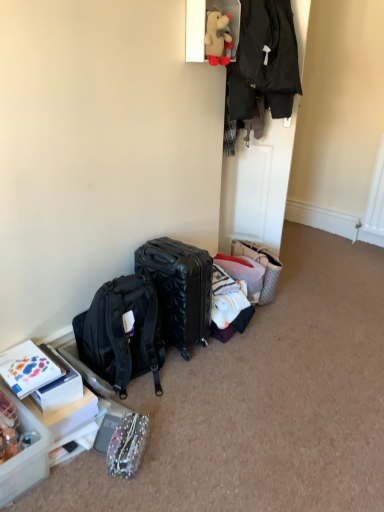
Question: Considering the relative sizes of white cotton shirt at center, arranged as the 2th clothing when viewed from the top, and black textured suitcase at center in the image provided, is white cotton shirt at center, arranged as the 2th clothing when viewed from the top, smaller than black textured suitcase at center?

Choices:
 (A) no
 (B) yes

Answer: (B)

Question: Is the position of white cotton shirt at center, arranged as the 2th clothing when viewed from the top, less distant than that of black textured suitcase at center?

Choices:
 (A) no
 (B) yes

Answer: (B)

Question: Is white cotton shirt at center, placed as the 1th clothing when sorted from bottom to top, to the left of black textured suitcase at center from the viewer's perspective?

Choices:
 (A) yes
 (B) no

Answer: (A)

Question: From the image's perspective, does white cotton shirt at center, arranged as the 2th clothing when viewed from the top, appear lower than black textured suitcase at center?

Choices:
 (A) no
 (B) yes

Answer: (B)

Question: Does white cotton shirt at center, placed as the 1th clothing when sorted from bottom to top, have a greater width compared to black textured suitcase at center?

Choices:
 (A) yes
 (B) no

Answer: (A)

Question: In terms of size, does matte black backpack at center appear bigger or smaller than translucent plastic container at lower left?

Choices:
 (A) small
 (B) big

Answer: (B)

Question: From the image's perspective, is matte black backpack at center above or below translucent plastic container at lower left?

Choices:
 (A) below
 (B) above

Answer: (B)

Question: Relative to translucent plastic container at lower left, is matte black backpack at center in front or behind?

Choices:
 (A) front
 (B) behind

Answer: (B)

Question: Considering the relative positions of matte black backpack at center and translucent plastic container at lower left in the image provided, is matte black backpack at center to the left or to the right of translucent plastic container at lower left?

Choices:
 (A) right
 (B) left

Answer: (A)

Question: Considering the relative positions of sparkly fabric pouch at lower left and black hardshell suitcase at center in the image provided, is sparkly fabric pouch at lower left to the left or to the right of black hardshell suitcase at center?

Choices:
 (A) left
 (B) right

Answer: (A)

Question: Relative to black hardshell suitcase at center, is sparkly fabric pouch at lower left in front or behind?

Choices:
 (A) behind
 (B) front

Answer: (B)

Question: Is sparkly fabric pouch at lower left taller or shorter than black hardshell suitcase at center?

Choices:
 (A) short
 (B) tall

Answer: (A)

Question: Based on their sizes in the image, would you say sparkly fabric pouch at lower left is bigger or smaller than black hardshell suitcase at center?

Choices:
 (A) big
 (B) small

Answer: (B)

Question: Is point (244, 282) positioned closer to the camera than point (140, 449)?

Choices:
 (A) farther
 (B) closer

Answer: (A)

Question: Is white cotton shirt at center, placed as the 1th clothing when sorted from bottom to top, in front of or behind sparkly fabric pouch at lower left in the image?

Choices:
 (A) behind
 (B) front

Answer: (A)